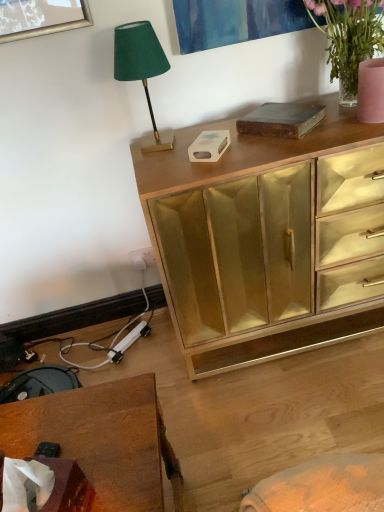
Question: From the image's perspective, would you say wooden desk at lower left is shown under translucent glass vase at upper right?

Choices:
 (A) yes
 (B) no

Answer: (A)

Question: Does wooden desk at lower left have a larger size compared to translucent glass vase at upper right?

Choices:
 (A) yes
 (B) no

Answer: (A)

Question: Is there a large distance between wooden desk at lower left and translucent glass vase at upper right?

Choices:
 (A) yes
 (B) no

Answer: (A)

Question: Is wooden desk at lower left not inside translucent glass vase at upper right?

Choices:
 (A) no
 (B) yes

Answer: (B)

Question: Can you see wooden desk at lower left touching translucent glass vase at upper right?

Choices:
 (A) yes
 (B) no

Answer: (B)

Question: Can you confirm if wooden desk at lower left is taller than translucent glass vase at upper right?

Choices:
 (A) yes
 (B) no

Answer: (A)

Question: Considering the relative positions of wooden desk at lower left and green velvet lampshade at upper left in the image provided, is wooden desk at lower left to the left of green velvet lampshade at upper left from the viewer's perspective?

Choices:
 (A) yes
 (B) no

Answer: (A)

Question: Would you say green velvet lampshade at upper left is part of wooden desk at lower left's contents?

Choices:
 (A) no
 (B) yes

Answer: (A)

Question: Is wooden desk at lower left placed right next to green velvet lampshade at upper left?

Choices:
 (A) no
 (B) yes

Answer: (A)

Question: Is wooden desk at lower left thinner than green velvet lampshade at upper left?

Choices:
 (A) yes
 (B) no

Answer: (B)

Question: Is green velvet lampshade at upper left at the back of wooden desk at lower left?

Choices:
 (A) no
 (B) yes

Answer: (A)

Question: From a real-world perspective, is wooden desk at lower left physically above green velvet lampshade at upper left?

Choices:
 (A) yes
 (B) no

Answer: (B)

Question: Does translucent glass vase at upper right have a lesser height compared to wooden desk at lower left?

Choices:
 (A) no
 (B) yes

Answer: (B)